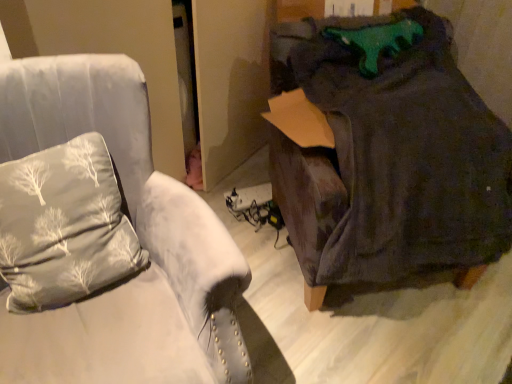
Question: From a real-world perspective, is velvet gray armchair at left positioned over silky gray pillow at left based on gravity?

Choices:
 (A) yes
 (B) no

Answer: (B)

Question: Can you confirm if velvet gray armchair at left is taller than silky gray pillow at left?

Choices:
 (A) yes
 (B) no

Answer: (A)

Question: Is velvet gray armchair at left outside of silky gray pillow at left?

Choices:
 (A) no
 (B) yes

Answer: (B)

Question: Is the surface of velvet gray armchair at left in direct contact with silky gray pillow at left?

Choices:
 (A) yes
 (B) no

Answer: (B)

Question: Does velvet gray armchair at left have a greater width compared to silky gray pillow at left?

Choices:
 (A) no
 (B) yes

Answer: (B)

Question: From the image's perspective, is silky gray pillow at left located above or below velvet gray armchair at left?

Choices:
 (A) below
 (B) above

Answer: (B)

Question: Looking at their shapes, would you say silky gray pillow at left is wider or thinner than velvet gray armchair at left?

Choices:
 (A) thin
 (B) wide

Answer: (A)

Question: Is silky gray pillow at left bigger or smaller than velvet gray armchair at left?

Choices:
 (A) small
 (B) big

Answer: (A)

Question: Would you say silky gray pillow at left is inside or outside velvet gray armchair at left?

Choices:
 (A) outside
 (B) inside

Answer: (B)

Question: Visually, is velvet gray armchair at left positioned to the left or to the right of silky gray pillow at left?

Choices:
 (A) left
 (B) right

Answer: (B)

Question: Looking at their shapes, would you say velvet gray armchair at left is wider or thinner than silky gray pillow at left?

Choices:
 (A) thin
 (B) wide

Answer: (B)

Question: Is velvet gray armchair at left bigger or smaller than silky gray pillow at left?

Choices:
 (A) big
 (B) small

Answer: (A)

Question: Does point (202, 249) appear closer or farther from the camera than point (70, 243)?

Choices:
 (A) closer
 (B) farther

Answer: (A)

Question: Do you think dark gray fabric bean bag at right is within velvet gray armchair at left, or outside of it?

Choices:
 (A) inside
 (B) outside

Answer: (B)

Question: Visually, is dark gray fabric bean bag at right positioned to the left or to the right of velvet gray armchair at left?

Choices:
 (A) left
 (B) right

Answer: (B)